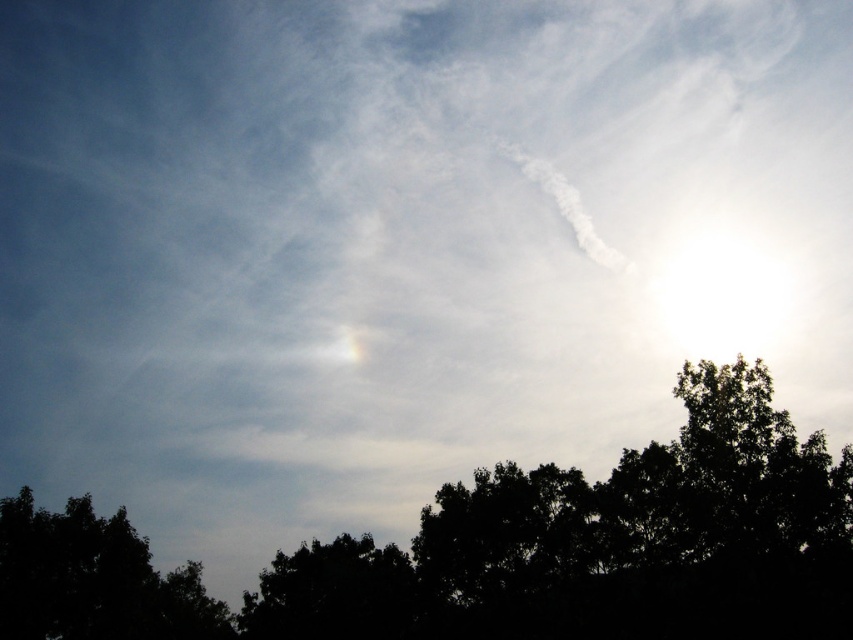
You are standing in a field and see the black leafy tree at lower center and the dark green leafy tree at lower left. Which tree is closer to you?

The black leafy tree at lower center is closer to you because it is in front of the dark green leafy tree at lower left.